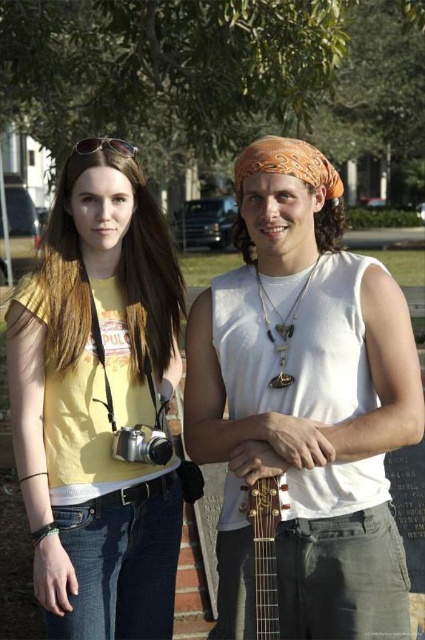
You are a photographer who wants to take a closeup shot of the sunglasses at upper left. However, the wooden acoustic guitar at center is blocking your view. Can you move the guitar to capture the sunglasses clearly?

The wooden acoustic guitar at center is in front of sunglasses at upper left, so moving the guitar would allow you to capture the sunglasses clearly.